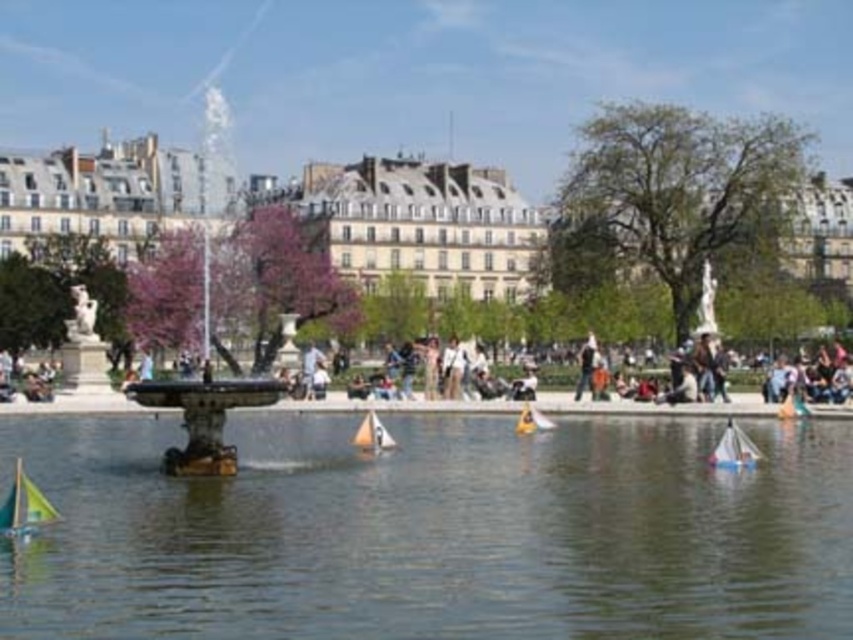
Which is above, clear water at center or yellow-green plastic sailboat at lower left?

Positioned higher is yellow-green plastic sailboat at lower left.

Looking at this image, does clear water at center have a lesser height compared to yellow-green plastic sailboat at lower left?

No.

Is point (59, 525) in front of point (25, 520)?

No, it is behind (25, 520).

The image size is (853, 640). I want to click on clear water at center, so click(432, 531).

Does clear water at center come behind white plastic sailboat at center?

That is False.

How far apart are clear water at center and white plastic sailboat at center?

clear water at center and white plastic sailboat at center are 16.73 meters apart.

What are the coordinates of `clear water at center` in the screenshot? It's located at tap(432, 531).

At what (x,y) coordinates should I click in order to perform the action: click on clear water at center. Please return your answer as a coordinate pair (x, y). The height and width of the screenshot is (640, 853). Looking at the image, I should click on (432, 531).

Is point (25, 496) positioned after point (379, 440)?

No, (25, 496) is in front of (379, 440).

Between yellow-green plastic sailboat at lower left and white plastic sailboat at center, which one appears on the left side from the viewer's perspective?

From the viewer's perspective, yellow-green plastic sailboat at lower left appears more on the left side.

Locate an element on the screen. yellow-green plastic sailboat at lower left is located at coordinates (24, 506).